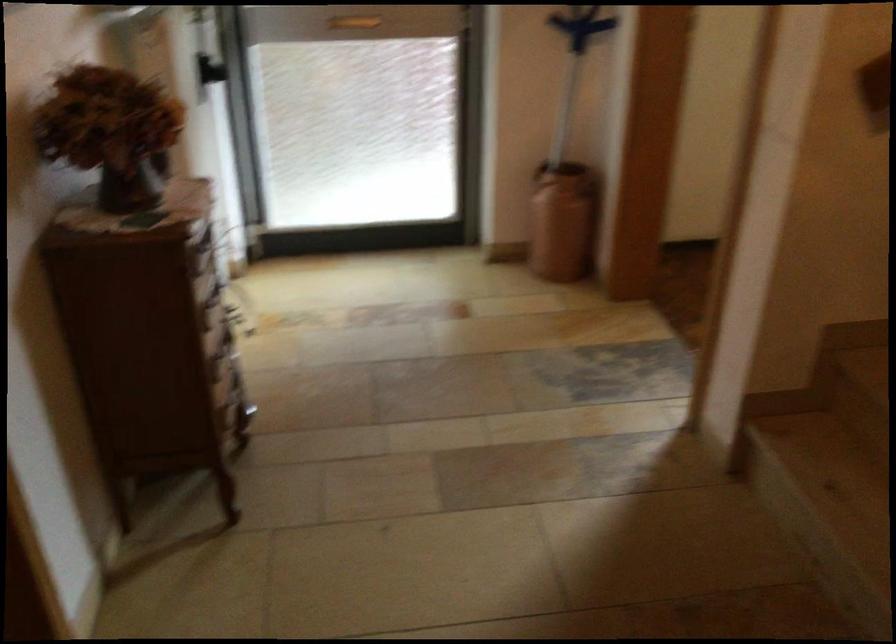
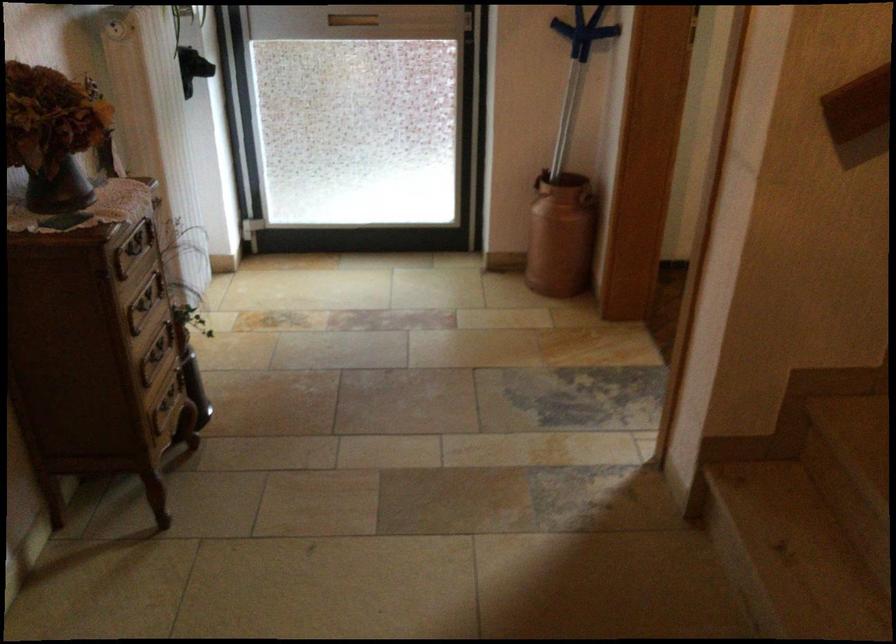
The point at [216,299] is marked in the first image. Where is the corresponding point in the second image?

(144, 303)